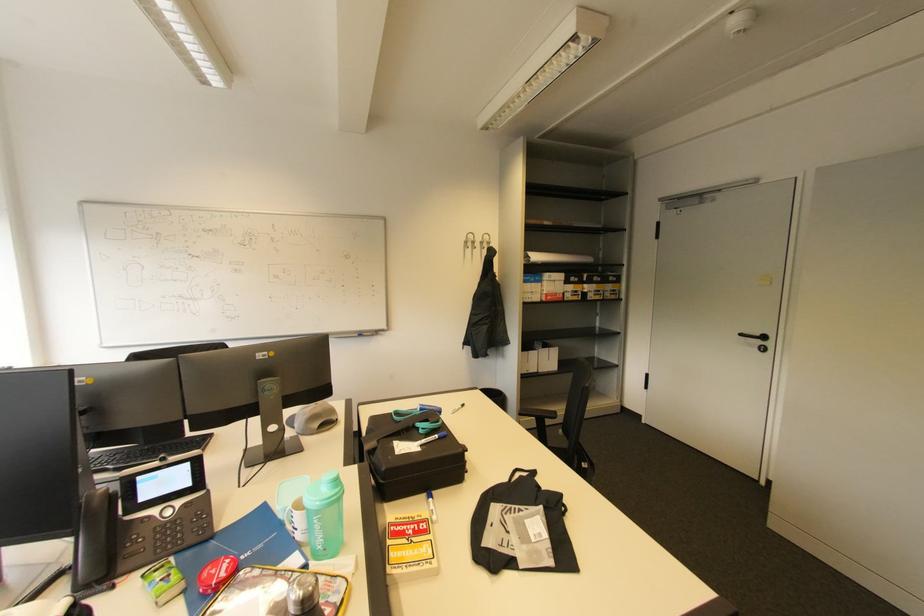
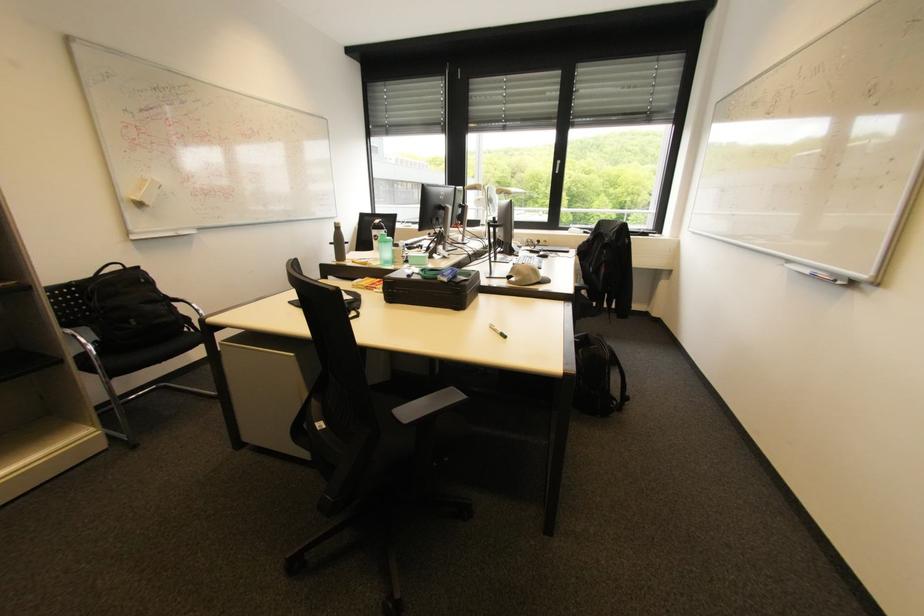
Locate, in the second image, the point that corresponds to (x=463, y=408) in the first image.

(501, 329)